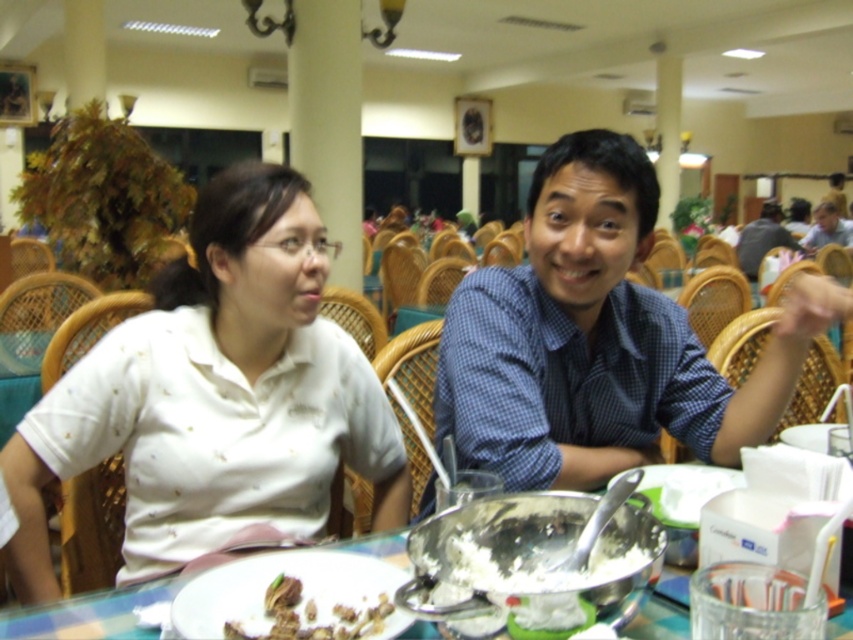
Does blue checkered shirt at center have a lesser width compared to matte blue shirt at center?

Indeed, blue checkered shirt at center has a lesser width compared to matte blue shirt at center.

From the picture: Does blue checkered shirt at center have a larger size compared to matte blue shirt at center?

Actually, blue checkered shirt at center might be smaller than matte blue shirt at center.

Consider the image. Measure the distance between point (525,376) and camera.

1.25 meters

What are the coordinates of `blue checkered shirt at center` in the screenshot? It's located at (599, 339).

Does brown crumbly cake at lower center appear on the left side of matte blue shirt at center?

Yes, brown crumbly cake at lower center is to the left of matte blue shirt at center.

Is brown crumbly cake at lower center wider than matte blue shirt at center?

No, brown crumbly cake at lower center is not wider than matte blue shirt at center.

The height and width of the screenshot is (640, 853). Describe the element at coordinates (310, 616) in the screenshot. I see `brown crumbly cake at lower center` at that location.

Where is `brown crumbly cake at lower center`? The width and height of the screenshot is (853, 640). brown crumbly cake at lower center is located at coordinates (310, 616).

Does white matte shirt at center have a greater height compared to blue checkered shirt at center?

Yes, white matte shirt at center is taller than blue checkered shirt at center.

Between point (35, 428) and point (612, 292), which one is positioned in front?

Point (35, 428) is more forward.

Measure the distance between white matte shirt at center and camera.

white matte shirt at center is 3.78 feet away from camera.

Locate an element on the screen. white matte shirt at center is located at coordinates (215, 396).